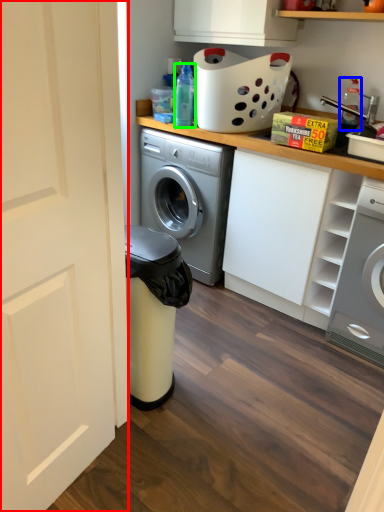
Question: Which is farther away from door (highlighted by a red box)? cleaning product (highlighted by a blue box) or bottle (highlighted by a green box)?

Choices:
 (A) cleaning product
 (B) bottle

Answer: (A)